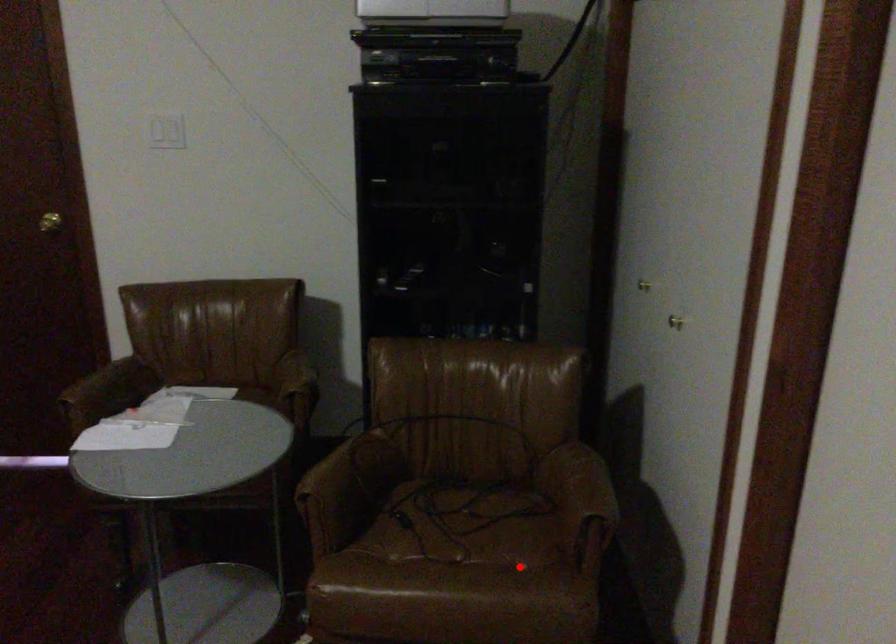
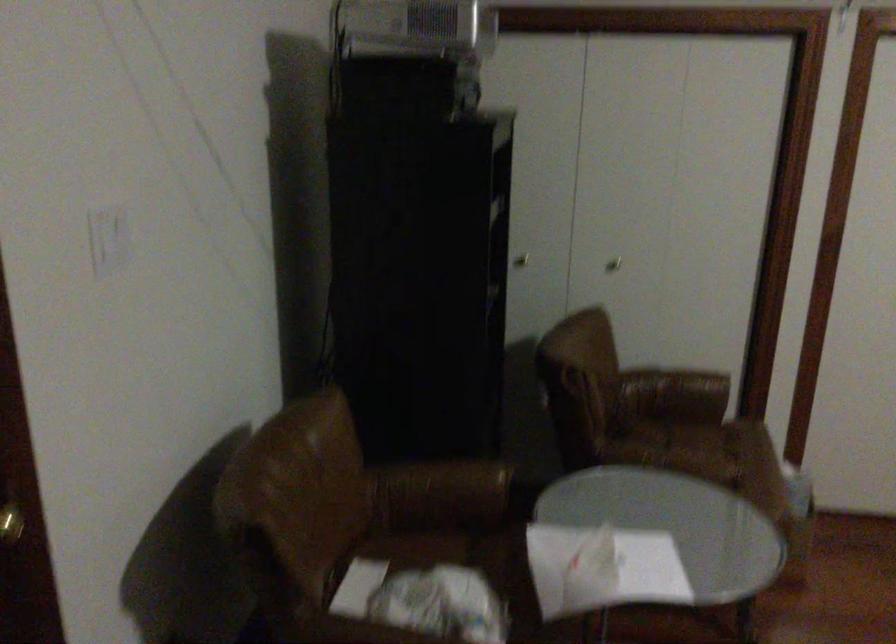
Question: I am providing you with two images of the same scene from different viewpoints. A red point is marked on the first image. Can you still see the location of the red point in image 2?

Choices:
 (A) Yes
 (B) No

Answer: (A)